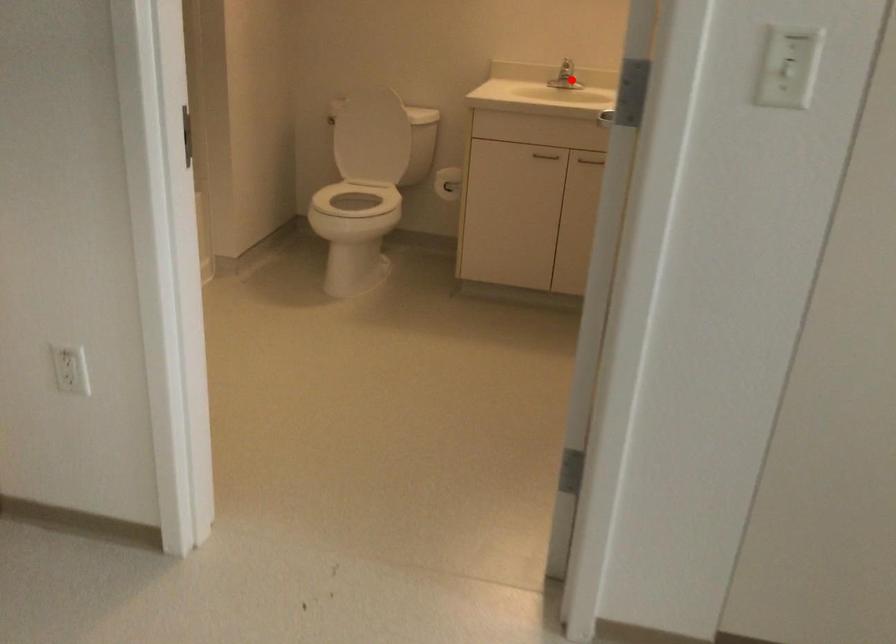
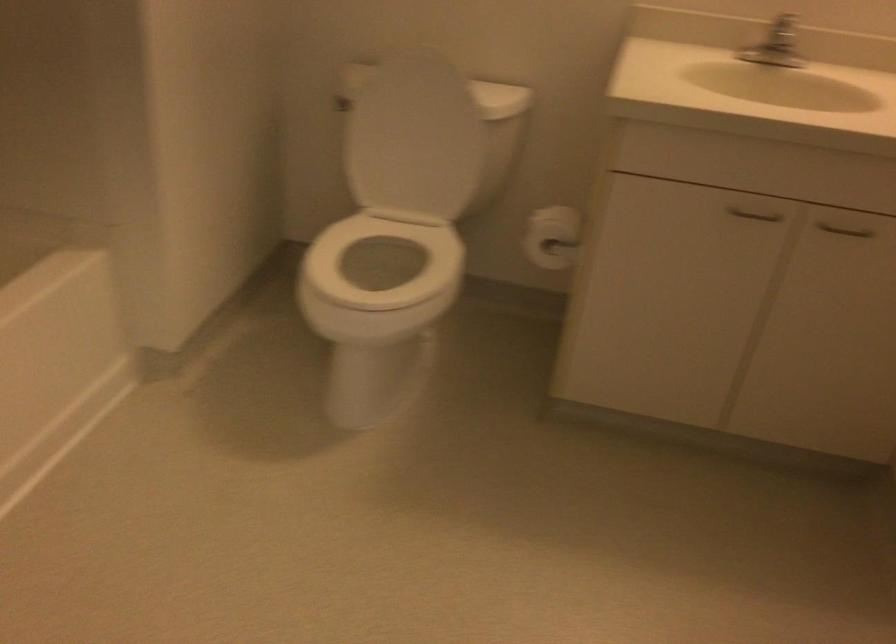
Where in the second image is the point corresponding to the highlighted location from the first image?

(778, 55)